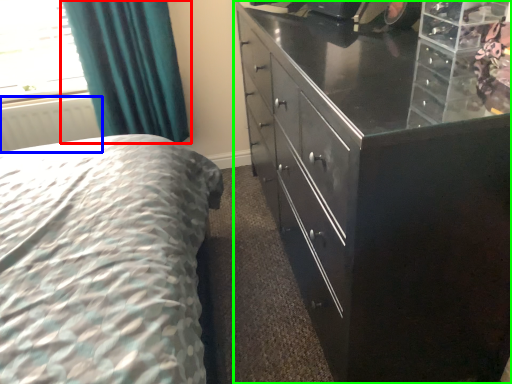
Question: Which object is the closest to the curtain (highlighted by a red box)? Choose among these: radiator (highlighted by a blue box) or chest of drawers (highlighted by a green box).

Choices:
 (A) radiator
 (B) chest of drawers

Answer: (A)